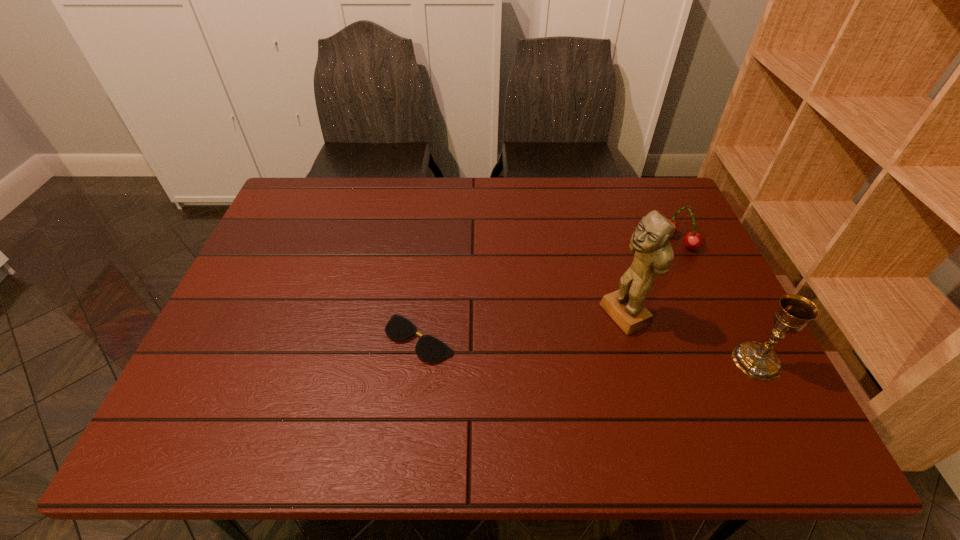
Where is `spectacles`? The image size is (960, 540). spectacles is located at coordinates (428, 348).

Where is `the leftmost object`? This screenshot has width=960, height=540. the leftmost object is located at coordinates (428, 348).

Locate an element on the screen. The width and height of the screenshot is (960, 540). the second tallest object is located at coordinates (759, 361).

Where is `the tallest object`? The height and width of the screenshot is (540, 960). the tallest object is located at coordinates (654, 254).

I want to click on the second object from left to right, so click(x=654, y=254).

Where is `the second shortest object`? the second shortest object is located at coordinates (693, 240).

You are a GUI agent. You are given a task and a screenshot of the screen. Output one action in this format:
    pyautogui.click(x=<x>, y=<y>)
    Task: Click on the cherry
    The width and height of the screenshot is (960, 540).
    Given the screenshot: What is the action you would take?
    pyautogui.click(x=693, y=240)

Where is `vacant space located 0.360m on the right of the leftmost object`? vacant space located 0.360m on the right of the leftmost object is located at coordinates (608, 339).

Where is `vacant space located on the front of the chalice`? The image size is (960, 540). vacant space located on the front of the chalice is located at coordinates (778, 402).

At what (x,y) coordinates should I click in order to perform the action: click on free region located on the front-facing side of the figurine. Please return your answer as a coordinate pair (x, y). The image size is (960, 540). Looking at the image, I should click on (541, 356).